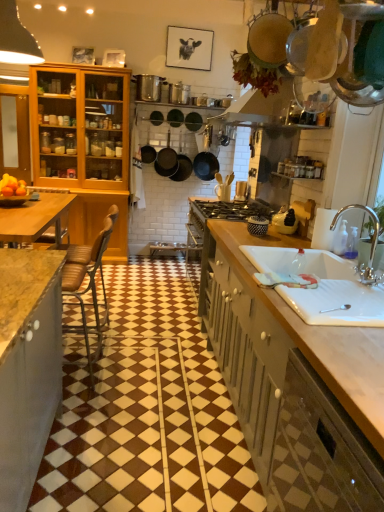
Question: Can you confirm if matte black frying pan at center is wider than silver metallic faucet at sink right?

Choices:
 (A) no
 (B) yes

Answer: (B)

Question: Can you confirm if matte black frying pan at center is shorter than silver metallic faucet at sink right?

Choices:
 (A) no
 (B) yes

Answer: (A)

Question: Can you see matte black frying pan at center touching silver metallic faucet at sink right?

Choices:
 (A) no
 (B) yes

Answer: (A)

Question: From a real-world perspective, is matte black frying pan at center beneath silver metallic faucet at sink right?

Choices:
 (A) yes
 (B) no

Answer: (B)

Question: Considering the relative positions of matte black frying pan at center and silver metallic faucet at sink right in the image provided, is matte black frying pan at center behind silver metallic faucet at sink right?

Choices:
 (A) no
 (B) yes

Answer: (B)

Question: From the image's perspective, does matte black frying pan at center appear lower than silver metallic faucet at sink right?

Choices:
 (A) no
 (B) yes

Answer: (A)

Question: Would you say green matte cabinet at lower right, the 3th cabinetry from the top, is a long distance from matte wooden cabinet at left, which appears as the 3th cabinetry when viewed from the right?

Choices:
 (A) no
 (B) yes

Answer: (B)

Question: Considering the relative sizes of green matte cabinet at lower right, the 3th cabinetry from the top, and matte wooden cabinet at left, which appears as the 3th cabinetry when viewed from the right, in the image provided, is green matte cabinet at lower right, the 3th cabinetry from the top, taller than matte wooden cabinet at left, which appears as the 3th cabinetry when viewed from the right,?

Choices:
 (A) yes
 (B) no

Answer: (B)

Question: Is green matte cabinet at lower right, which ranks as the third cabinetry in back-to-front order, outside of matte wooden cabinet at left, which appears as the 3th cabinetry when viewed from the right?

Choices:
 (A) yes
 (B) no

Answer: (A)

Question: Considering the relative sizes of green matte cabinet at lower right, placed as the first cabinetry when sorted from front to back, and matte wooden cabinet at left, which is the first cabinetry in back-to-front order, in the image provided, is green matte cabinet at lower right, placed as the first cabinetry when sorted from front to back, shorter than matte wooden cabinet at left, which is the first cabinetry in back-to-front order,?

Choices:
 (A) no
 (B) yes

Answer: (B)

Question: Can you confirm if green matte cabinet at lower right, positioned as the first cabinetry in bottom-to-top order, is positioned to the right of matte wooden cabinet at left, which is the first cabinetry in back-to-front order?

Choices:
 (A) yes
 (B) no

Answer: (A)

Question: Is green matte cabinet at lower right, which ranks as the third cabinetry in back-to-front order, aimed at matte wooden cabinet at left, which appears as the 3th cabinetry when viewed from the right?

Choices:
 (A) yes
 (B) no

Answer: (B)

Question: Can you confirm if matte black frying pan at center is wider than wooden countertop at right, positioned as the second cabinetry in front-to-back order?

Choices:
 (A) no
 (B) yes

Answer: (A)